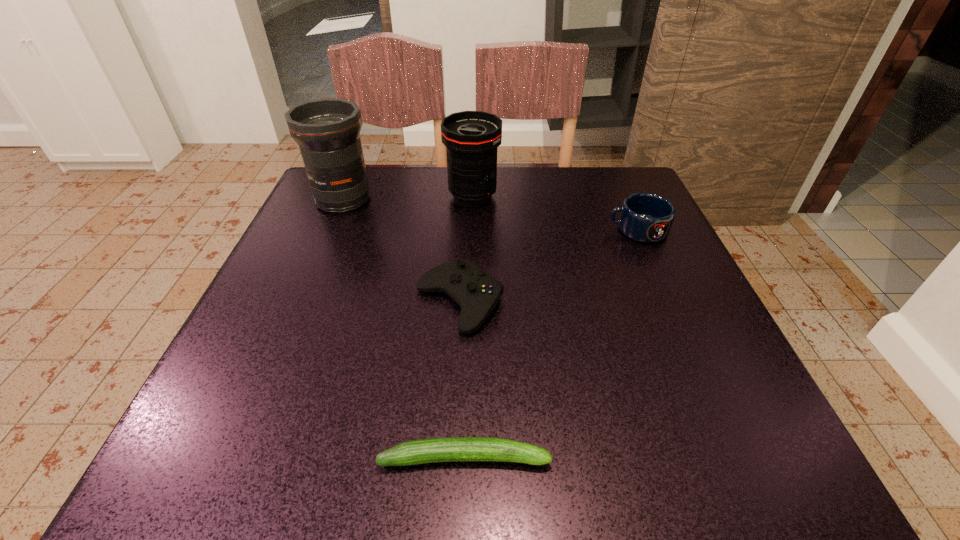
This screenshot has width=960, height=540. Find the location of `free point between the leftmost object and the third tallest object`. free point between the leftmost object and the third tallest object is located at coordinates (491, 215).

Locate an element on the screen. The height and width of the screenshot is (540, 960). vacant area that lies between the control and the leftmost object is located at coordinates (401, 252).

This screenshot has width=960, height=540. In order to click on vacant area that lies between the control and the left telephoto lens in this screenshot , I will do [401, 252].

Locate an element on the screen. The height and width of the screenshot is (540, 960). vacant region between the left telephoto lens and the shortest object is located at coordinates (404, 329).

Where is `empty space between the fourth shortest object and the leftmost object`? empty space between the fourth shortest object and the leftmost object is located at coordinates (408, 198).

Identify the location of vacant area between the shorter telephoto lens and the second nearest object. (466, 249).

Identify which object is the third closest to the second tallest object. Please provide its 2D coordinates. Your answer should be formatted as a tuple, i.e. [(x, y)], where the tuple contains the x and y coordinates of a point satisfying the conditions above.

[(645, 217)]

I want to click on object that is the third nearest to the zucchini, so click(327, 130).

Where is `free spot that satisfies the following two spatial constraints: 1. with the handle on the side of the third tallest object; 2. on the front side of the control`? The height and width of the screenshot is (540, 960). free spot that satisfies the following two spatial constraints: 1. with the handle on the side of the third tallest object; 2. on the front side of the control is located at coordinates (670, 303).